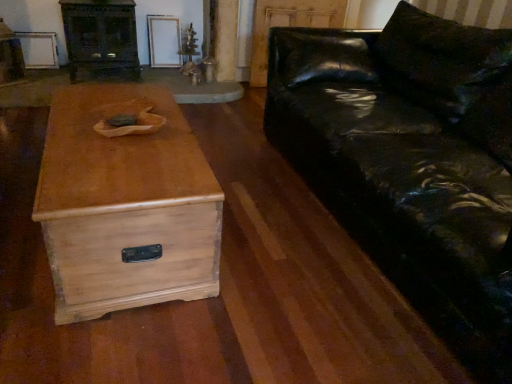
Question: From the image's perspective, would you say glossy black leather couch at right is shown under dark wood entertainment center at upper left?

Choices:
 (A) no
 (B) yes

Answer: (B)

Question: From a real-world perspective, is glossy black leather couch at right on top of dark wood entertainment center at upper left?

Choices:
 (A) yes
 (B) no

Answer: (A)

Question: From a real-world perspective, is glossy black leather couch at right located beneath dark wood entertainment center at upper left?

Choices:
 (A) yes
 (B) no

Answer: (B)

Question: From the image's perspective, would you say glossy black leather couch at right is positioned over dark wood entertainment center at upper left?

Choices:
 (A) no
 (B) yes

Answer: (A)

Question: Is glossy black leather couch at right completely or partially outside of dark wood entertainment center at upper left?

Choices:
 (A) yes
 (B) no

Answer: (A)

Question: From the image's perspective, is light wood chest at center located above or below glossy black leather couch at right?

Choices:
 (A) below
 (B) above

Answer: (A)

Question: Do you think light wood chest at center is within glossy black leather couch at right, or outside of it?

Choices:
 (A) outside
 (B) inside

Answer: (A)

Question: In terms of size, does light wood chest at center appear bigger or smaller than glossy black leather couch at right?

Choices:
 (A) small
 (B) big

Answer: (A)

Question: In terms of width, does light wood chest at center look wider or thinner when compared to glossy black leather couch at right?

Choices:
 (A) thin
 (B) wide

Answer: (A)

Question: From a real-world perspective, relative to light wood chest at center, is glossy black leather couch at right vertically above or below?

Choices:
 (A) above
 (B) below

Answer: (A)

Question: Is glossy black leather couch at right taller or shorter than light wood chest at center?

Choices:
 (A) tall
 (B) short

Answer: (A)

Question: Looking at the image, does glossy black leather couch at right seem bigger or smaller compared to light wood chest at center?

Choices:
 (A) big
 (B) small

Answer: (A)

Question: Is glossy black leather couch at right wider or thinner than light wood chest at center?

Choices:
 (A) thin
 (B) wide

Answer: (B)

Question: Based on their sizes in the image, would you say light wood chest at center is bigger or smaller than dark wood entertainment center at upper left?

Choices:
 (A) small
 (B) big

Answer: (B)

Question: Is light wood chest at center in front of or behind dark wood entertainment center at upper left in the image?

Choices:
 (A) front
 (B) behind

Answer: (A)